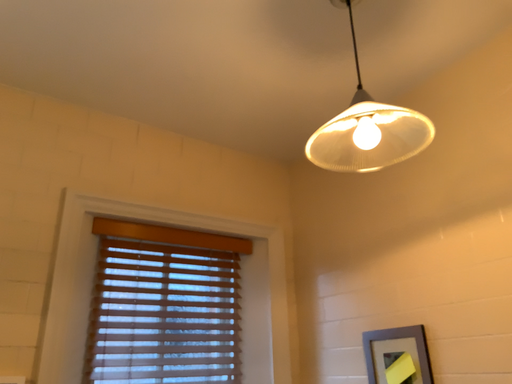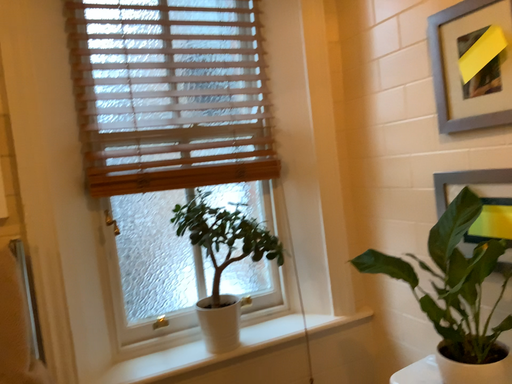
Question: Which way did the camera rotate in the video?

Choices:
 (A) rotated downward
 (B) rotated upward

Answer: (A)